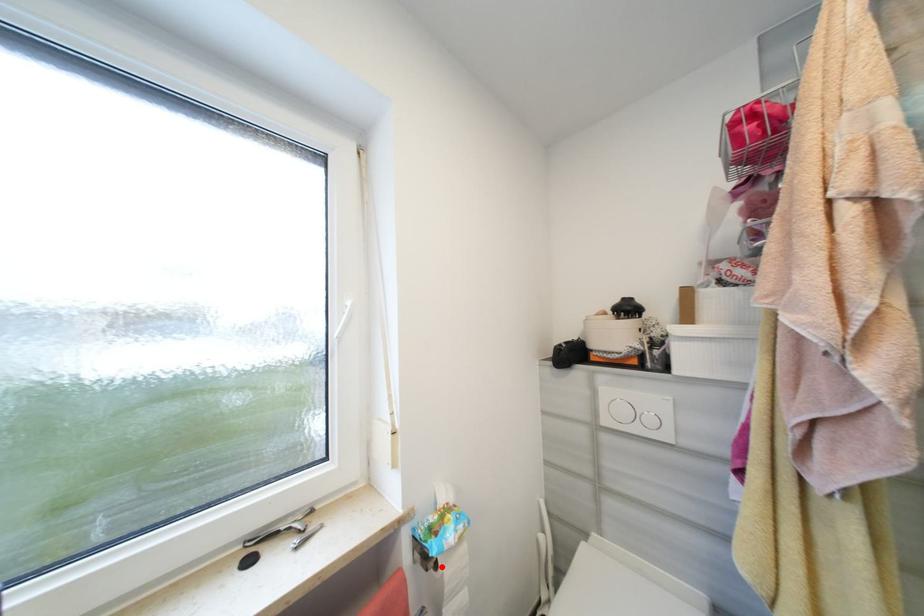
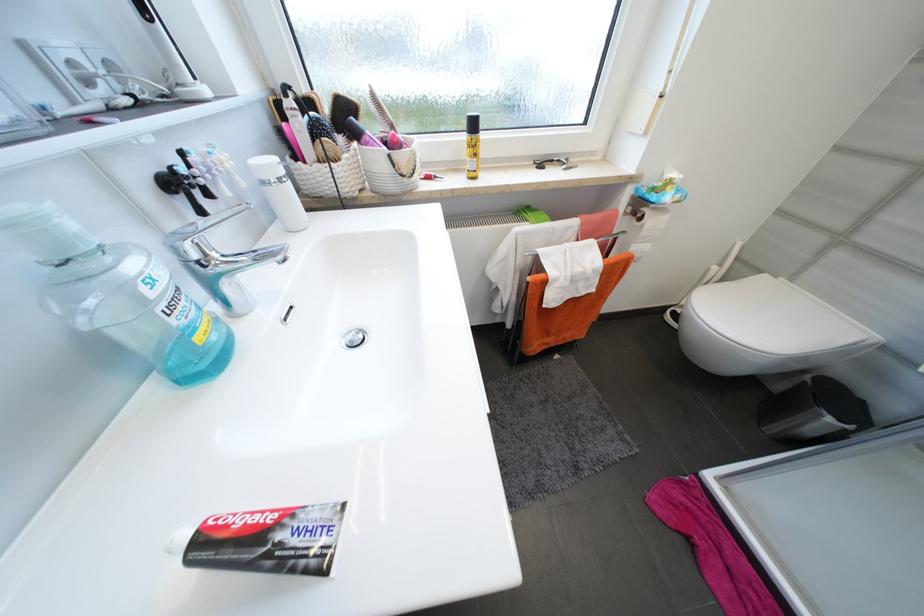
Question: I am providing you with two images of the same scene from different viewpoints. Image1 has a red point marked. In image2, the corresponding 3D location appears at what relative position? Reply with the corresponding letter.

Choices:
 (A) Closer
 (B) Farther

Answer: (A)